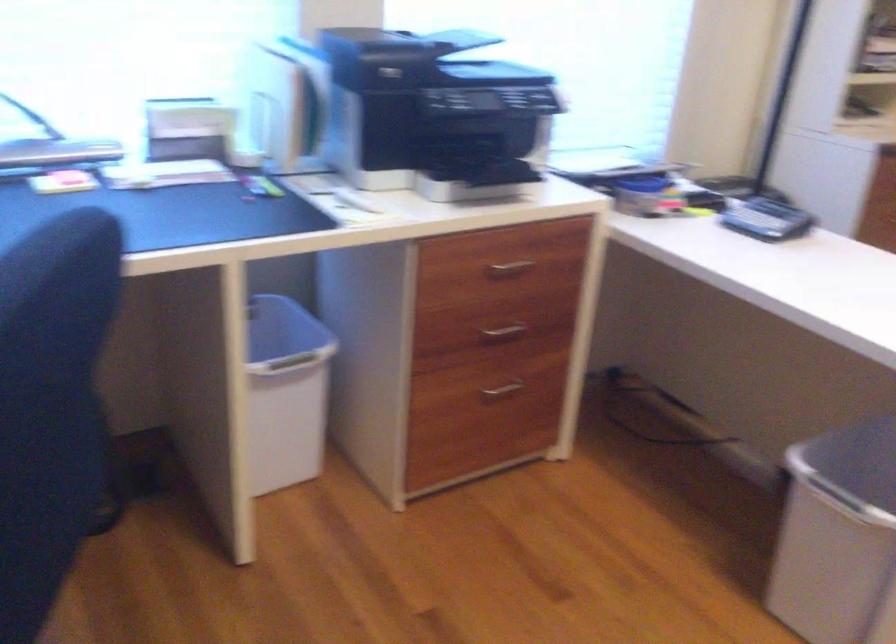
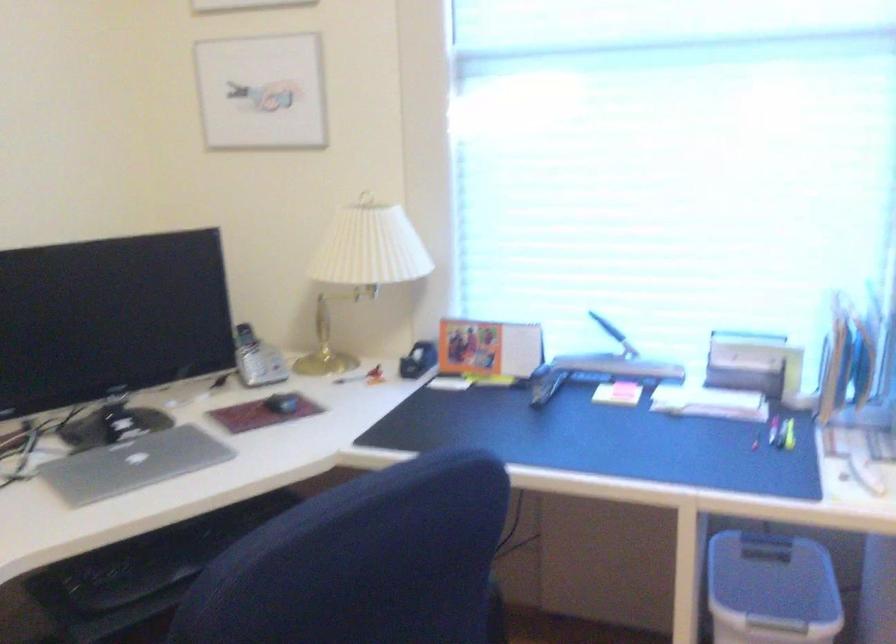
Question: Based on the continuous images, in which direction is the camera rotating? Reply with the corresponding letter.

Choices:
 (A) Left
 (B) Right
 (C) Up
 (D) Down

Answer: (A)